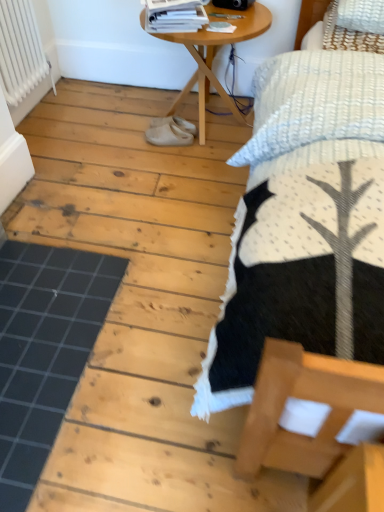
Question: From the image's perspective, is black rubber mat at lower left on top of white glossy magazine at upper center?

Choices:
 (A) yes
 (B) no

Answer: (B)

Question: Is black rubber mat at lower left at the left side of white glossy magazine at upper center?

Choices:
 (A) yes
 (B) no

Answer: (A)

Question: Is black rubber mat at lower left positioned beyond the bounds of white glossy magazine at upper center?

Choices:
 (A) no
 (B) yes

Answer: (B)

Question: Is black rubber mat at lower left facing towards white glossy magazine at upper center?

Choices:
 (A) yes
 (B) no

Answer: (B)

Question: Is black rubber mat at lower left next to white glossy magazine at upper center and touching it?

Choices:
 (A) yes
 (B) no

Answer: (B)

Question: Considering the relative sizes of black rubber mat at lower left and white glossy magazine at upper center in the image provided, is black rubber mat at lower left bigger than white glossy magazine at upper center?

Choices:
 (A) no
 (B) yes

Answer: (B)

Question: Does white rubber shoes at center, which is the first footwear in bottom-to-top order, have a greater width compared to wooden table at center?

Choices:
 (A) yes
 (B) no

Answer: (B)

Question: From a real-world perspective, is white rubber shoes at center, arranged as the 2th footwear when viewed from the top, below wooden table at center?

Choices:
 (A) no
 (B) yes

Answer: (B)

Question: Does white rubber shoes at center, arranged as the 2th footwear when viewed from the top, contain wooden table at center?

Choices:
 (A) no
 (B) yes

Answer: (A)

Question: Does white rubber shoes at center, arranged as the 2th footwear when viewed from the top, lie behind wooden table at center?

Choices:
 (A) no
 (B) yes

Answer: (B)

Question: Can you confirm if white rubber shoes at center, arranged as the 2th footwear when viewed from the top, is positioned to the left of wooden table at center?

Choices:
 (A) yes
 (B) no

Answer: (A)

Question: Considering the relative positions of white rubber shoes at center, which is the first footwear in bottom-to-top order, and wooden table at center in the image provided, is white rubber shoes at center, which is the first footwear in bottom-to-top order, in front of wooden table at center?

Choices:
 (A) yes
 (B) no

Answer: (B)

Question: From a real-world perspective, does white textured bed at upper right sit lower than wooden table at center?

Choices:
 (A) no
 (B) yes

Answer: (A)